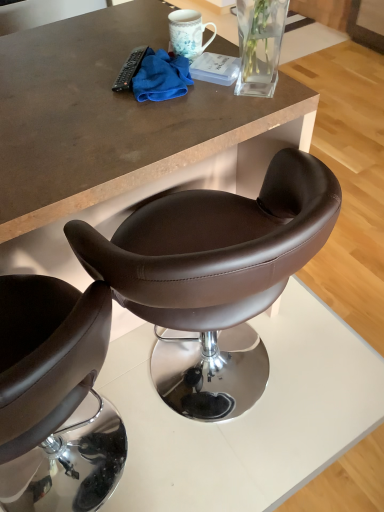
Question: Could you tell me if brown leather chair at center is turned towards blue microfiber cloth at upper center?

Choices:
 (A) yes
 (B) no

Answer: (A)

Question: From the image's perspective, is brown leather chair at center beneath blue microfiber cloth at upper center?

Choices:
 (A) yes
 (B) no

Answer: (A)

Question: Considering the relative positions of brown leather chair at center and blue microfiber cloth at upper center in the image provided, is brown leather chair at center to the left of blue microfiber cloth at upper center from the viewer's perspective?

Choices:
 (A) yes
 (B) no

Answer: (B)

Question: Is brown leather chair at center not close to blue microfiber cloth at upper center?

Choices:
 (A) yes
 (B) no

Answer: (B)

Question: Does brown leather chair at center have a lesser width compared to blue microfiber cloth at upper center?

Choices:
 (A) no
 (B) yes

Answer: (A)

Question: From a real-world perspective, relative to blue microfiber cloth at upper center, is black plastic remote control at upper center vertically above or below?

Choices:
 (A) above
 (B) below

Answer: (B)

Question: Is black plastic remote control at upper center bigger or smaller than blue microfiber cloth at upper center?

Choices:
 (A) small
 (B) big

Answer: (A)

Question: Is point (125, 71) closer or farther from the camera than point (132, 82)?

Choices:
 (A) closer
 (B) farther

Answer: (B)

Question: Is black plastic remote control at upper center inside the boundaries of blue microfiber cloth at upper center, or outside?

Choices:
 (A) inside
 (B) outside

Answer: (B)

Question: Visually, is matte brown leather stool at center positioned to the left or to the right of black plastic remote control at upper center?

Choices:
 (A) left
 (B) right

Answer: (A)

Question: Is matte brown leather stool at center inside the boundaries of black plastic remote control at upper center, or outside?

Choices:
 (A) inside
 (B) outside

Answer: (B)

Question: In terms of height, does matte brown leather stool at center look taller or shorter compared to black plastic remote control at upper center?

Choices:
 (A) short
 (B) tall

Answer: (B)

Question: Relative to black plastic remote control at upper center, is matte brown leather stool at center in front or behind?

Choices:
 (A) behind
 (B) front

Answer: (B)

Question: Is blue microfiber cloth at upper center taller or shorter than matte brown leather stool at center?

Choices:
 (A) short
 (B) tall

Answer: (A)

Question: Considering the positions of blue microfiber cloth at upper center and matte brown leather stool at center in the image, is blue microfiber cloth at upper center wider or thinner than matte brown leather stool at center?

Choices:
 (A) wide
 (B) thin

Answer: (B)